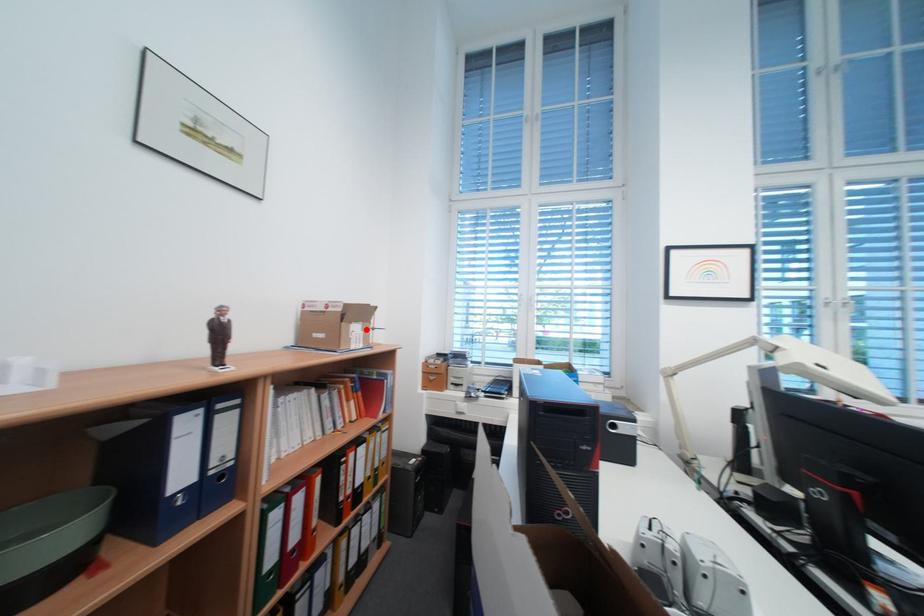
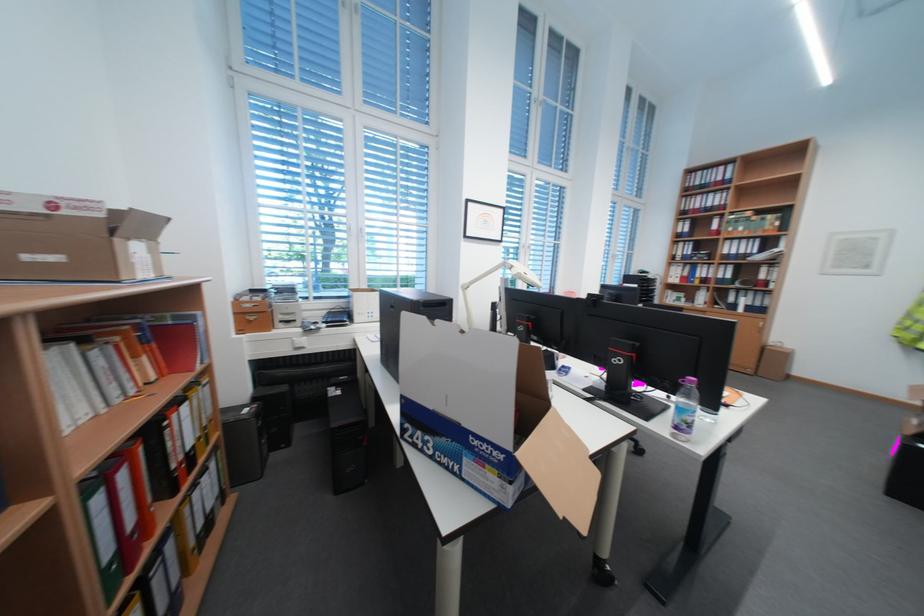
The point at the highlighted location is marked in the first image. Where is the corresponding point in the second image?

(148, 249)